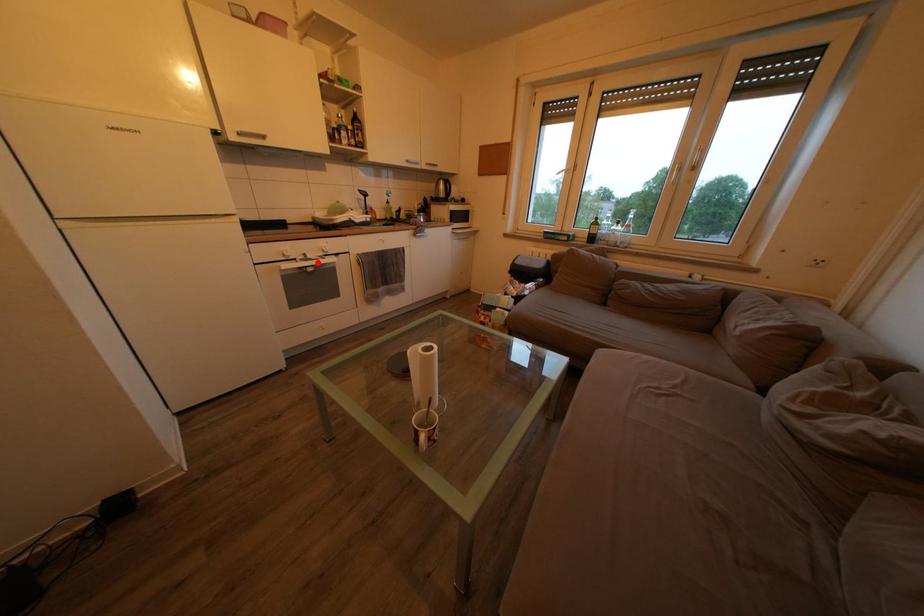
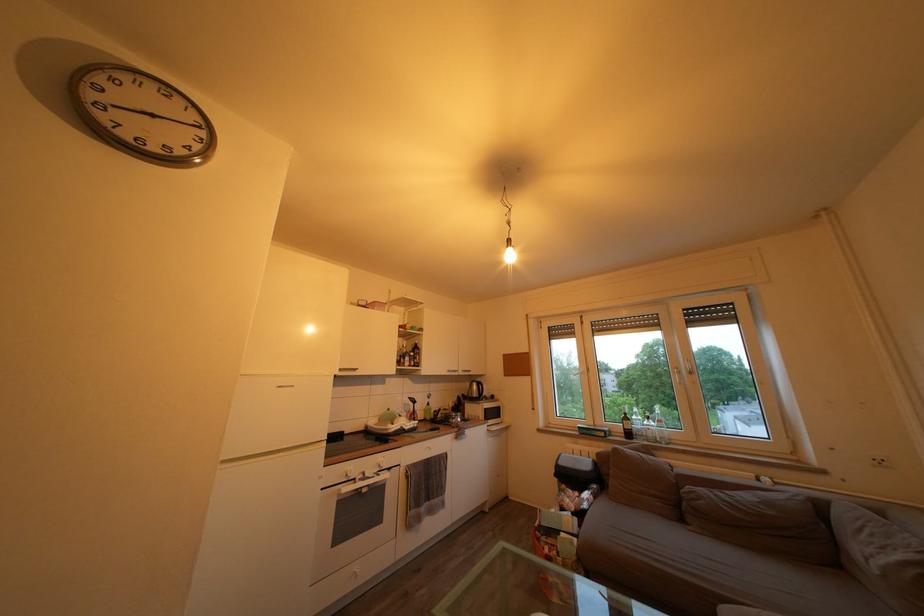
Locate, in the second image, the point that corresponds to the highlighted location in the first image.

(375, 480)